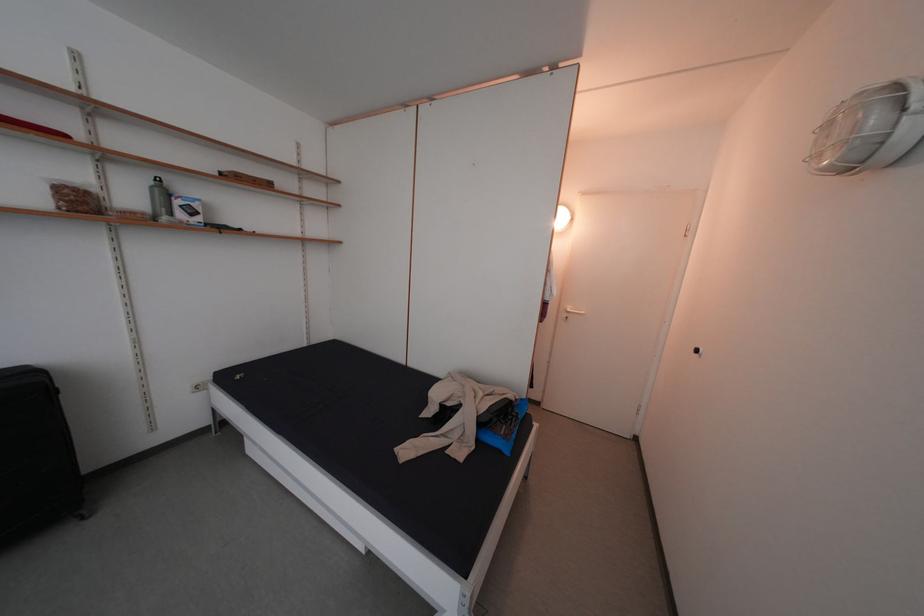
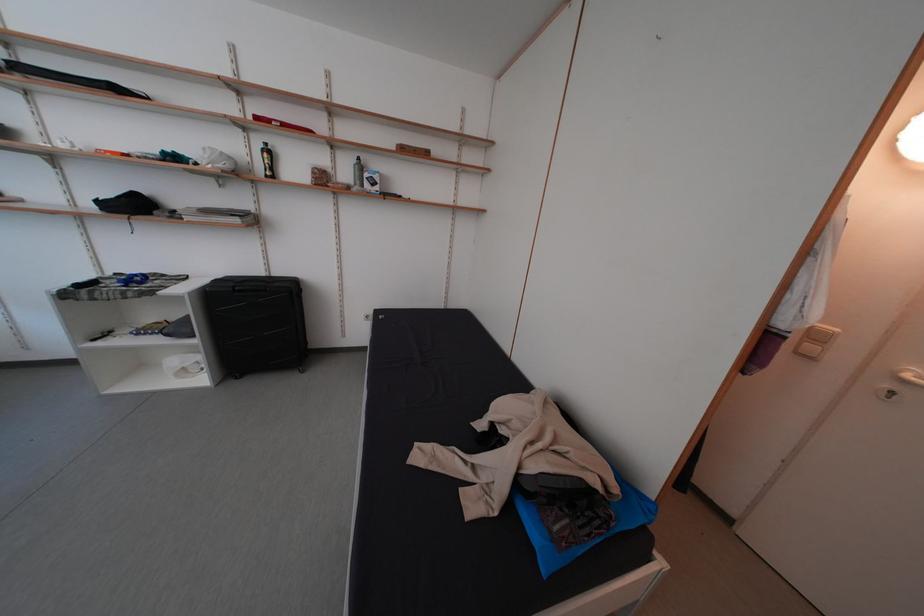
The point at [140,203] is marked in the first image. Where is the corresponding point in the second image?

(354, 179)